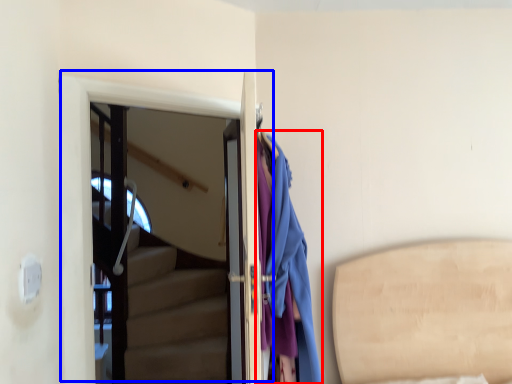
Question: Which object appears closest to the camera in this image, clothing (highlighted by a red box) or door (highlighted by a blue box)?

Choices:
 (A) clothing
 (B) door

Answer: (A)